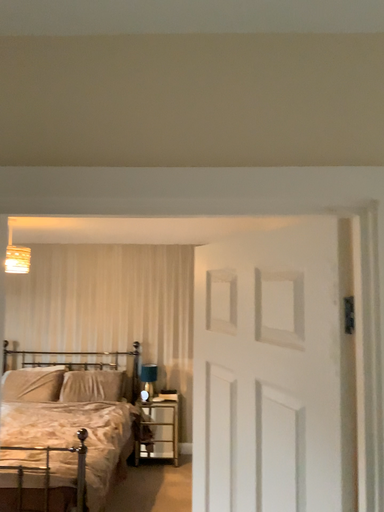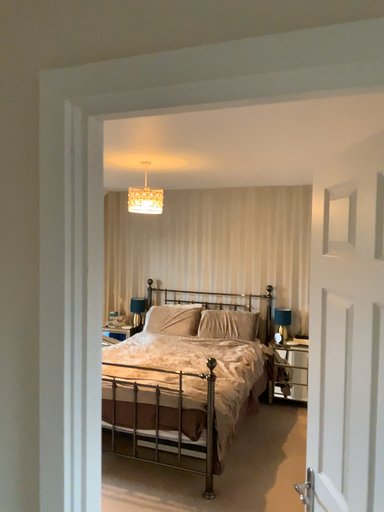
Question: Which way did the camera rotate in the video?

Choices:
 (A) rotated upward
 (B) rotated downward

Answer: (B)